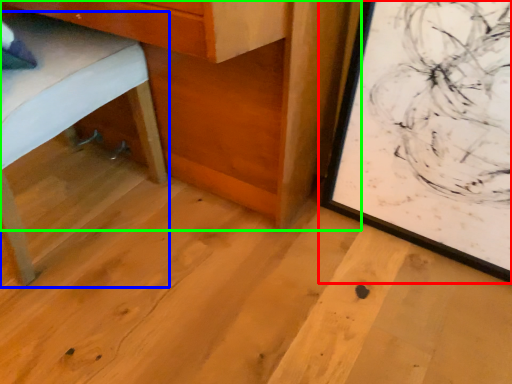
Question: Which is farther away from picture frame (highlighted by a red box)? furniture (highlighted by a blue box) or table (highlighted by a green box)?

Choices:
 (A) furniture
 (B) table

Answer: (A)